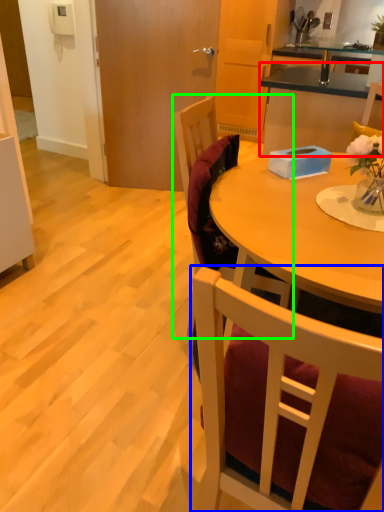
Question: Based on their relative distances, which object is nearer to cabinetry (highlighted by a red box)? Choose from chair (highlighted by a blue box) and chair (highlighted by a green box).

Choices:
 (A) chair
 (B) chair

Answer: (B)